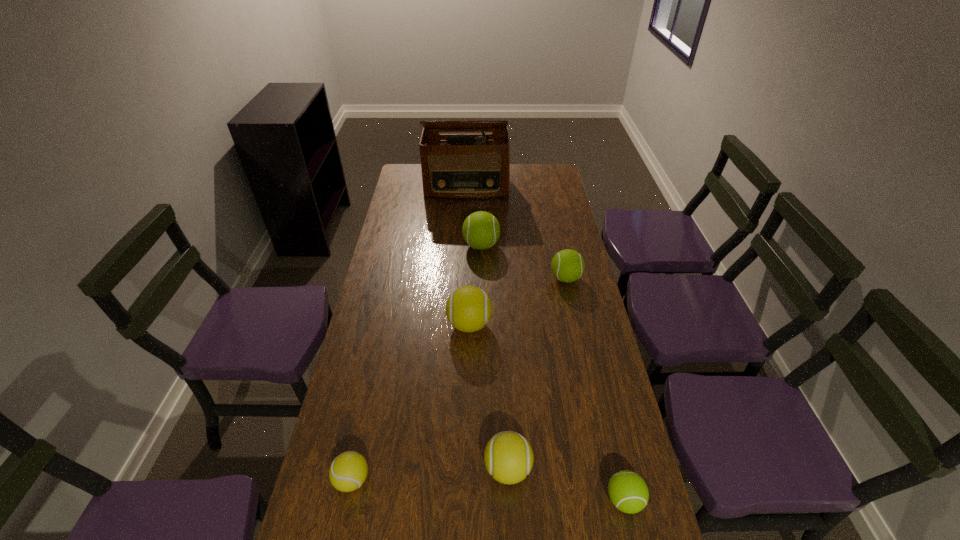
Image resolution: width=960 pixels, height=540 pixels. Identify the location of free point between the tallest object and the farthest yellow tennis ball. (468, 256).

Locate an element on the screen. This screenshot has height=540, width=960. vacant space that is in between the biggest yellow tennis ball and the smallest green tennis ball is located at coordinates (546, 412).

At what (x,y) coordinates should I click in order to perform the action: click on object that stands as the sixth closest to the second farthest tennis ball. Please return your answer as a coordinate pair (x, y). Looking at the image, I should click on coord(348,471).

Find the location of a particular element. The width and height of the screenshot is (960, 540). object that is the sixth closest one to the smallest yellow tennis ball is located at coordinates (454, 166).

Locate which tennis ball is the fifth closest to the second biggest green tennis ball. Please provide its 2D coordinates. Your answer should be formatted as a tuple, i.e. [(x, y)], where the tuple contains the x and y coordinates of a point satisfying the conditions above.

[(348, 471)]

Locate which tennis ball is the fifth closest to the farthest green tennis ball. Please provide its 2D coordinates. Your answer should be formatted as a tuple, i.e. [(x, y)], where the tuple contains the x and y coordinates of a point satisfying the conditions above.

[(628, 492)]

Locate an element on the screen. green tennis ball that is the second closest to the smallest yellow tennis ball is located at coordinates (567, 265).

The image size is (960, 540). I want to click on the closest green tennis ball relative to the second farthest object, so click(567, 265).

This screenshot has height=540, width=960. Identify the location of yellow tennis ball that stands as the second closest to the nearest green tennis ball. (468, 308).

What are the coordinates of `yellow tennis ball that stands as the closest to the leftmost tennis ball` in the screenshot? It's located at coord(508,457).